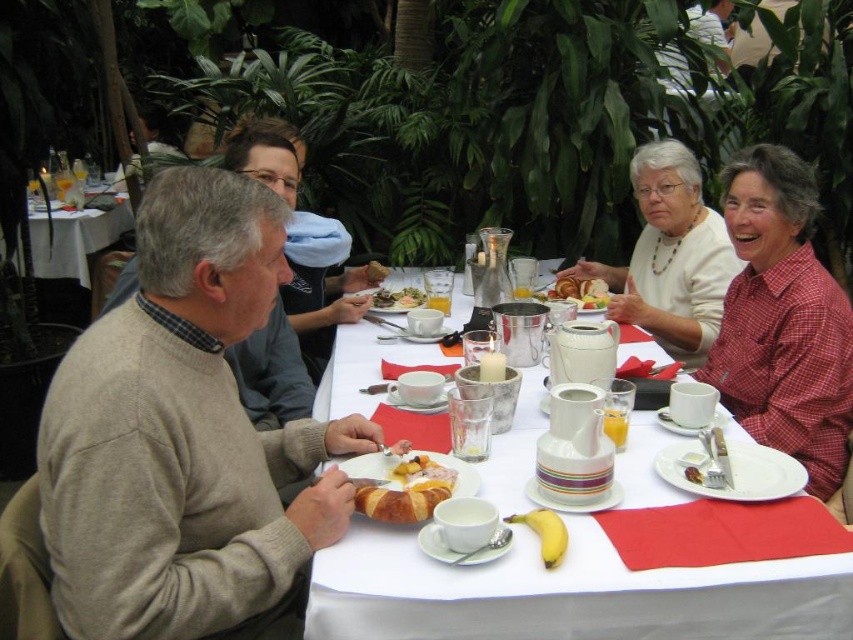
You are a server at the brunch table and need to deliver a dessert to the person wearing the white matte sweater at upper right. The dessert needs to be placed on the white porcelain plate at upper center. Can you place the dessert on the correct plate without moving the plate?

The white matte sweater at upper right is to the right of the white porcelain plate at upper center, so the dessert can be placed on the white porcelain plate at upper center without moving it since the plate is located to the left of the sweater.

You are a server at the brunch table. You need to place a new dessert plate between the white matte sweater at upper right and the yellow smooth banana at lower center. Which object should you move to make space?

The white matte sweater at upper right might be wider than the yellow smooth banana at lower center, so you should move the white matte sweater at upper right to make space for the dessert plate.